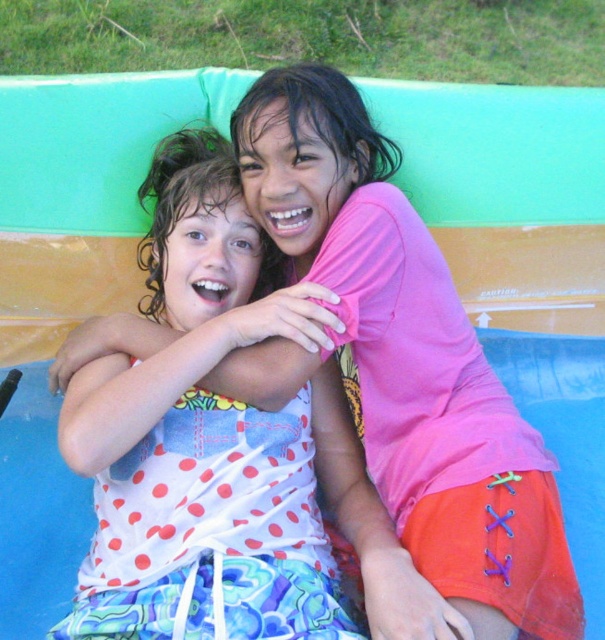
Question: Can you confirm if pink matte shirt at center is wider than white polka dot fabric at center?

Choices:
 (A) no
 (B) yes

Answer: (A)

Question: Which object appears closest to the camera in this image?

Choices:
 (A) white polka dot fabric at center
 (B) pink matte shirt at center

Answer: (A)

Question: Which object is closer to the camera taking this photo?

Choices:
 (A) pink matte shirt at center
 (B) white polka dot fabric at center

Answer: (B)

Question: Can you confirm if pink matte shirt at center is wider than white polka dot fabric at center?

Choices:
 (A) yes
 (B) no

Answer: (B)

Question: Which point is closer to the camera?

Choices:
 (A) pink matte shirt at center
 (B) white polka dot fabric at center

Answer: (B)

Question: In this image, where is pink matte shirt at center located relative to white polka dot fabric at center?

Choices:
 (A) left
 (B) right

Answer: (B)